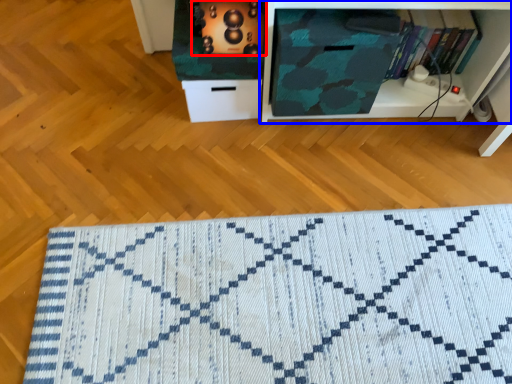
Question: Which point is further to the camera, appliance (highlighted by a red box) or shelf (highlighted by a blue box)?

Choices:
 (A) appliance
 (B) shelf

Answer: (B)